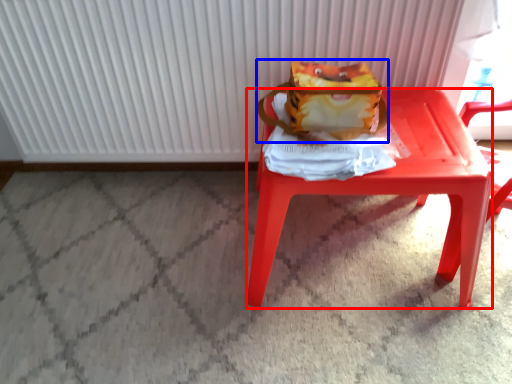
Question: Among these objects, which one is nearest to the camera, stool (highlighted by a red box) or shoulder bag (highlighted by a blue box)?

Choices:
 (A) stool
 (B) shoulder bag

Answer: (A)